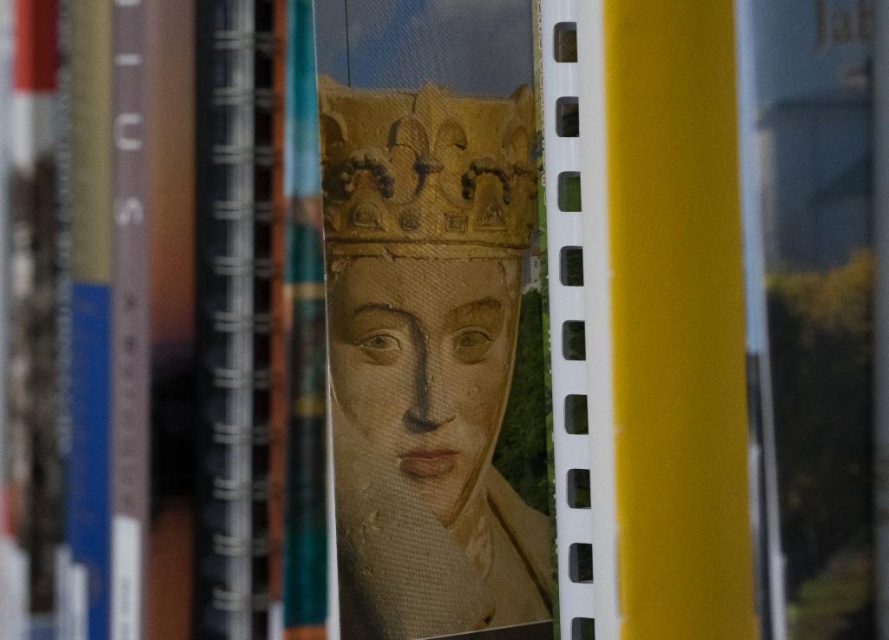
Question: Does matte gold crown at center appear under gold textured crown at center?

Choices:
 (A) no
 (B) yes

Answer: (B)

Question: Can you confirm if matte gold crown at center is positioned to the right of gold textured crown at center?

Choices:
 (A) no
 (B) yes

Answer: (A)

Question: Is matte gold crown at center further to the viewer compared to gold textured crown at center?

Choices:
 (A) no
 (B) yes

Answer: (B)

Question: Among these points, which one is nearest to the camera?

Choices:
 (A) (470, 314)
 (B) (338, 182)

Answer: (B)

Question: Which point is farther to the camera?

Choices:
 (A) (505, 284)
 (B) (471, 221)

Answer: (A)